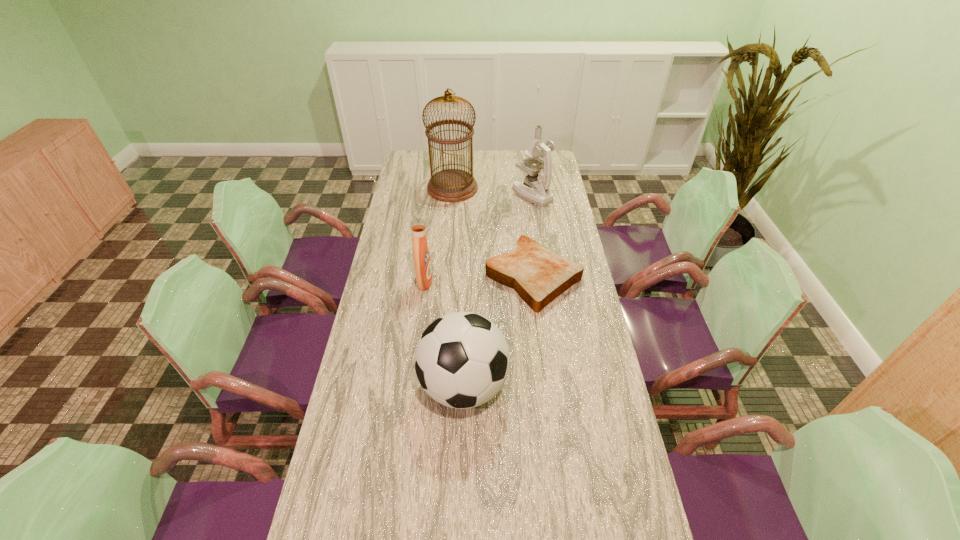
Where is `birdcage`? The width and height of the screenshot is (960, 540). birdcage is located at coordinates (451, 185).

Find the location of a particular element. the second tallest object is located at coordinates (536, 190).

Locate an element on the screen. detergent is located at coordinates (422, 263).

Find the location of `the nearest object`. the nearest object is located at coordinates (462, 359).

This screenshot has height=540, width=960. Find the location of `the shortest object`. the shortest object is located at coordinates (x=538, y=275).

Find the location of a particular element. This screenshot has width=960, height=540. vacant space located 0.200m on the front-facing side of the tallest object is located at coordinates (519, 188).

The image size is (960, 540). Identify the location of free space located on the back of the microscope. (527, 163).

Find the location of `free space located on the front-facing side of the detergent`. free space located on the front-facing side of the detergent is located at coordinates (536, 281).

At what (x,y) coordinates should I click in order to perform the action: click on free space located on the left of the nearest object. Please return your answer as a coordinate pair (x, y). The image size is (960, 540). Looking at the image, I should click on (383, 386).

This screenshot has width=960, height=540. Find the location of `free space located 0.250m on the back of the bread`. free space located 0.250m on the back of the bread is located at coordinates (525, 210).